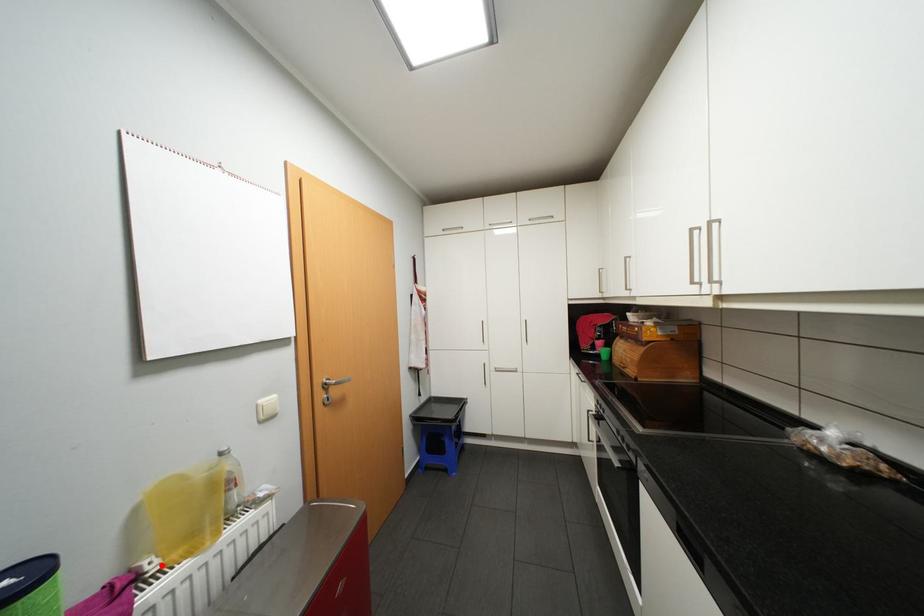
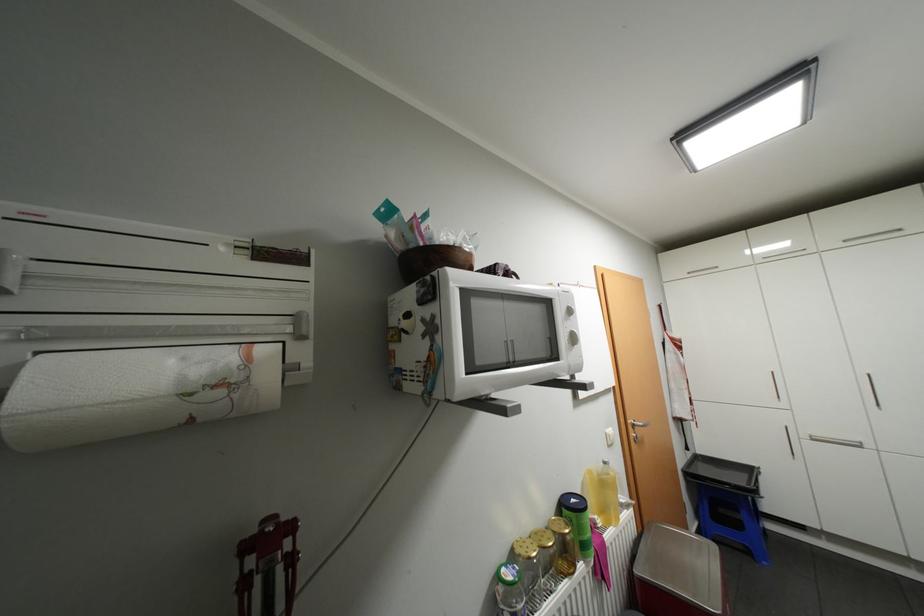
Question: I am providing you with two images of the same scene from different viewpoints. Image1 has a red point marked. In image2, the corresponding 3D location appears at what relative position? Reply with the corresponding letter.

Choices:
 (A) Closer
 (B) Farther

Answer: (B)